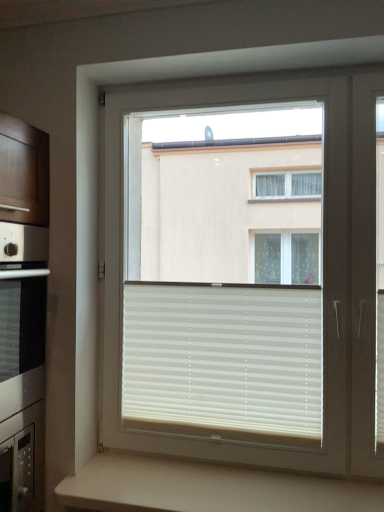
Question: Can you confirm if white matte blinds at center is taller than white plastic window at center?

Choices:
 (A) yes
 (B) no

Answer: (B)

Question: From a real-world perspective, is white matte blinds at center physically above white plastic window at center?

Choices:
 (A) no
 (B) yes

Answer: (A)

Question: Is white matte blinds at center oriented away from white plastic window at center?

Choices:
 (A) no
 (B) yes

Answer: (B)

Question: Considering the relative sizes of white matte blinds at center and white plastic window at center in the image provided, is white matte blinds at center shorter than white plastic window at center?

Choices:
 (A) no
 (B) yes

Answer: (B)

Question: Is white matte blinds at center to the right of white plastic window at center from the viewer's perspective?

Choices:
 (A) no
 (B) yes

Answer: (A)

Question: Considering the positions of point (274, 486) and point (281, 295), is point (274, 486) closer or farther from the camera than point (281, 295)?

Choices:
 (A) farther
 (B) closer

Answer: (B)

Question: Looking at their shapes, would you say beige matte counter at lower center is wider or thinner than white plastic window at center?

Choices:
 (A) wide
 (B) thin

Answer: (A)

Question: Which is correct: beige matte counter at lower center is inside white plastic window at center, or outside of it?

Choices:
 (A) outside
 (B) inside

Answer: (A)

Question: In the image, is beige matte counter at lower center positioned in front of or behind white plastic window at center?

Choices:
 (A) behind
 (B) front

Answer: (B)

Question: In the image, is white matte blinds at center on the left side or the right side of white plastic window at center?

Choices:
 (A) right
 (B) left

Answer: (B)

Question: Based on their sizes in the image, would you say white matte blinds at center is bigger or smaller than white plastic window at center?

Choices:
 (A) small
 (B) big

Answer: (A)

Question: In the image, is white matte blinds at center positioned in front of or behind white plastic window at center?

Choices:
 (A) front
 (B) behind

Answer: (B)

Question: In terms of height, does white matte blinds at center look taller or shorter compared to white plastic window at center?

Choices:
 (A) short
 (B) tall

Answer: (A)

Question: From the image's perspective, is white matte blinds at center located above or below beige matte counter at lower center?

Choices:
 (A) above
 (B) below

Answer: (A)

Question: Considering the relative positions of white matte blinds at center and beige matte counter at lower center in the image provided, is white matte blinds at center to the left or to the right of beige matte counter at lower center?

Choices:
 (A) left
 (B) right

Answer: (A)